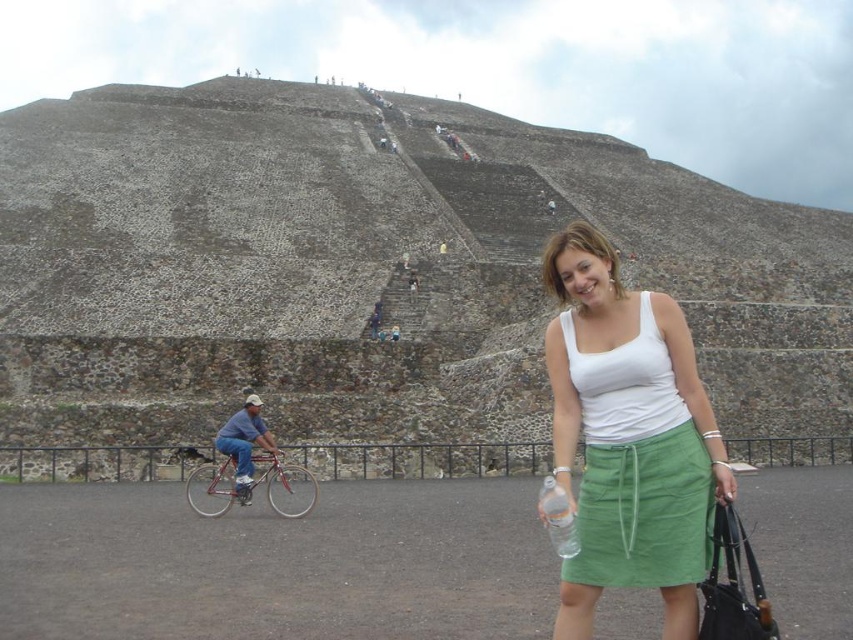
You are a photographer planning to take a photo of the white cotton tank top at center and the shiny red bicycle at left. Which object should you focus on first if you want to capture both clearly in the same frame?

The white cotton tank top at center is thinner than the shiny red bicycle at left, so you should focus on the white cotton tank top at center first to ensure both are in focus.

You are standing at the base of the pyramid and want to reach the top. There are two points marked on the pyramid steps. Which point is closer to the top? The point at coordinate (614,349) or the point at coordinate (554,483)?

Point (614,349) is behind point (554,483), so the point at coordinate (614,349) is closer to the top.

You are standing at the base of the pyramid and want to take a photo of the two points marked in the image. Which point is closer to your camera, point (627,424) or point (231,488)?

Point (627,424) is closer to the camera than point (231,488).